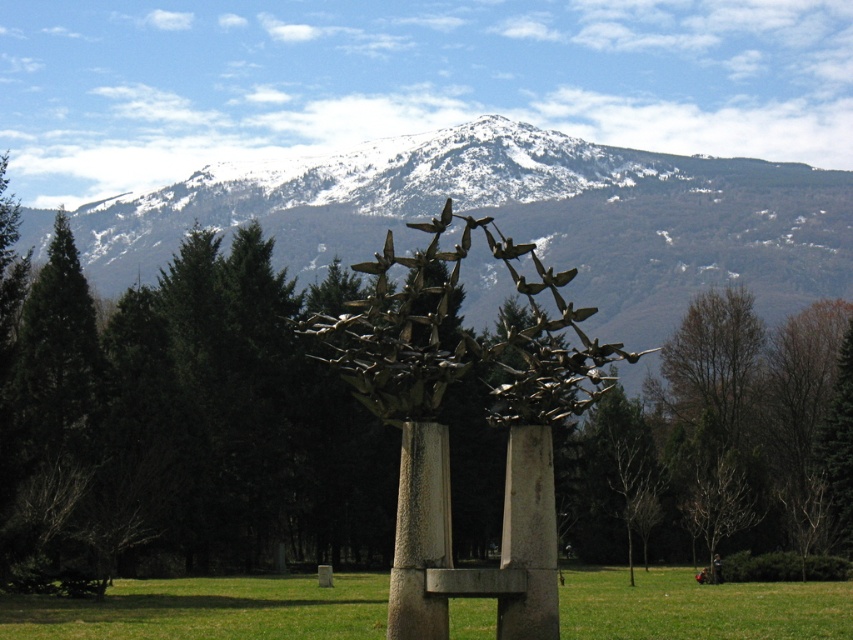
Which is behind, point (758, 355) or point (422, 557)?

The point (758, 355) is more distant.

Is point (662, 413) in front of point (413, 486)?

No.

Where is `metallic sculpture at center`? The height and width of the screenshot is (640, 853). metallic sculpture at center is located at coordinates (178, 420).

Is point (241, 371) closer to camera compared to point (473, 355)?

No, (241, 371) is further to viewer.

Is metallic sculpture at center below polished bronze birds at center?

Indeed, metallic sculpture at center is positioned under polished bronze birds at center.

Where is `metallic sculpture at center`? Image resolution: width=853 pixels, height=640 pixels. metallic sculpture at center is located at coordinates (178, 420).

Can you confirm if polished bronze birds at center is positioned above rusty metal pole at center?

Yes, polished bronze birds at center is above rusty metal pole at center.

Is polished bronze birds at center in front of rusty metal pole at center?

Yes.

This screenshot has height=640, width=853. Identify the location of polished bronze birds at center. (447, 429).